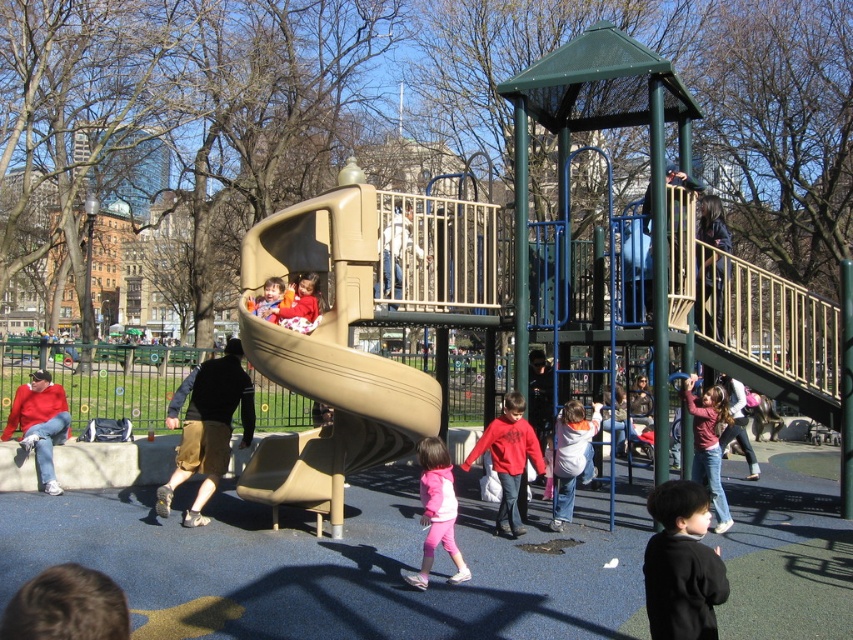
You are a parent looking for your child in the playground. You see the red cotton sweater at left and the light pink fabric at right. Which clothing item is closer to you?

The red cotton sweater at left is closer to you because it is in front of the light pink fabric at right.

You are a parent looking for your child who is wearing a red cotton sweater at left. You see the matte plastic slide at center. Which object is bigger in size?

The red cotton sweater at left is larger in size compared to the matte plastic slide at center.

You are a parent looking for your child who is wearing either the red cotton sweater at left or the light pink fabric at right. If you want to find the child with the wider clothing item, which one should you look for?

The light pink fabric at right is wider than the red cotton sweater at left, so you should look for the child wearing the light pink fabric at right.